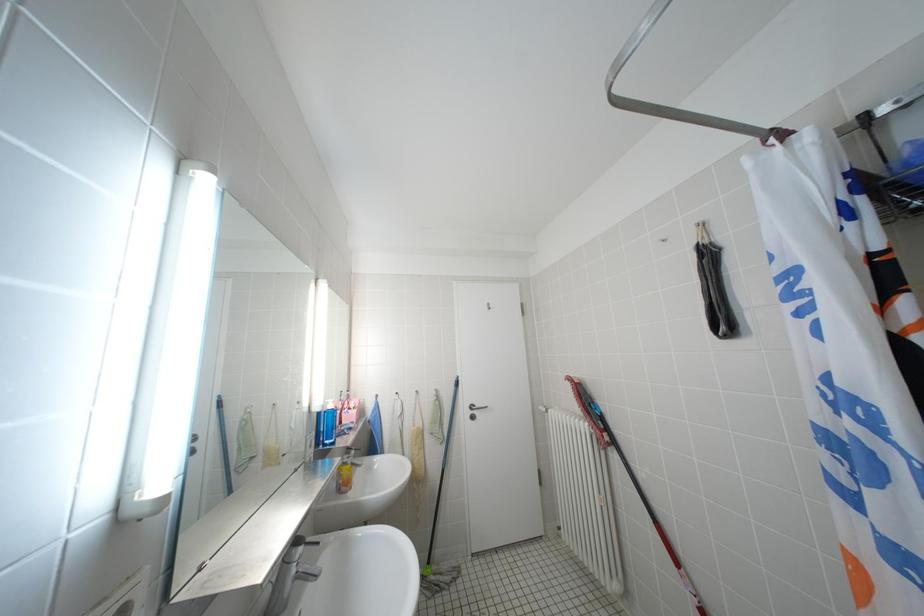
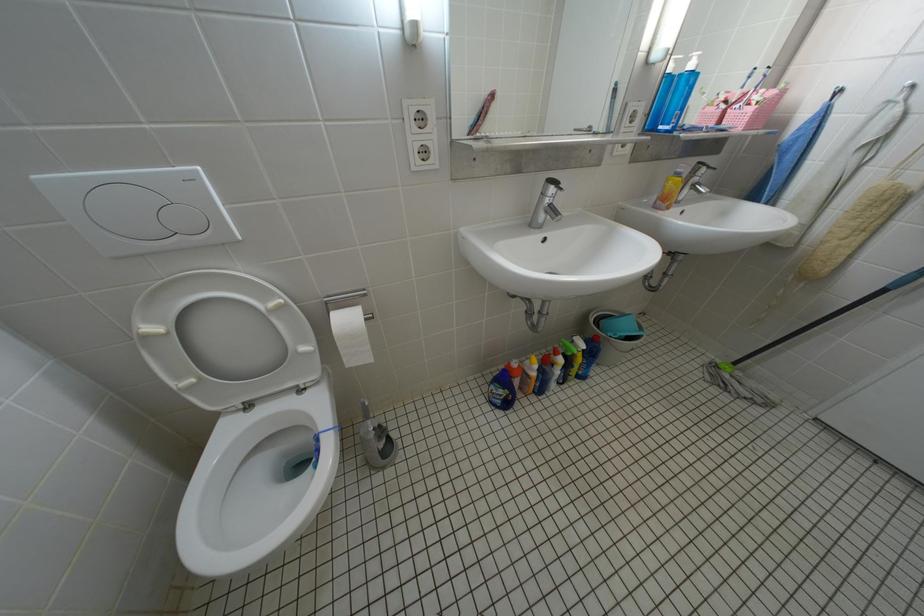
First-person continuous shooting, in which direction is the camera rotating?

The rotation direction of the camera is left-down.